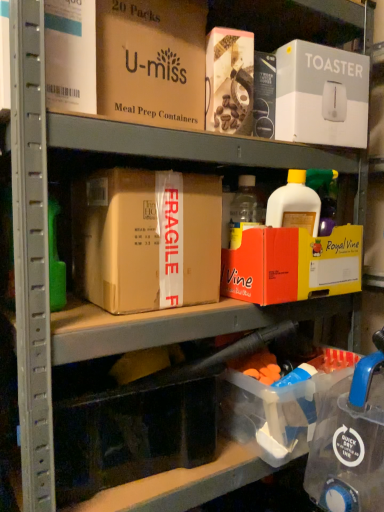
Question: Does transparent plastic storage box at lower center, which ranks as the second storage box in right-to-left order, appear on the right side of white cardboard toaster at upper right, the second box in the top-to-bottom sequence?

Choices:
 (A) no
 (B) yes

Answer: (A)

Question: Is there a large distance between transparent plastic storage box at lower center, which ranks as the second storage box in right-to-left order, and white cardboard toaster at upper right, the 3th box positioned from the bottom?

Choices:
 (A) yes
 (B) no

Answer: (B)

Question: From a real-world perspective, is transparent plastic storage box at lower center, which ranks as the second storage box in right-to-left order, under white cardboard toaster at upper right, the 3th box positioned from the bottom?

Choices:
 (A) no
 (B) yes

Answer: (B)

Question: Does transparent plastic storage box at lower center, which ranks as the 1th storage box in left-to-right order, come behind white cardboard toaster at upper right, the second box in the top-to-bottom sequence?

Choices:
 (A) no
 (B) yes

Answer: (A)

Question: Considering the relative sizes of transparent plastic storage box at lower center, which ranks as the 1th storage box in left-to-right order, and white cardboard toaster at upper right, the 3th box positioned from the bottom, in the image provided, is transparent plastic storage box at lower center, which ranks as the 1th storage box in left-to-right order, smaller than white cardboard toaster at upper right, the 3th box positioned from the bottom,?

Choices:
 (A) yes
 (B) no

Answer: (A)

Question: Visually, is orange cardboard box at upper center, the fourth box viewed from the top, positioned to the left or to the right of transparent plastic storage box at lower center, which ranks as the second storage box in right-to-left order?

Choices:
 (A) left
 (B) right

Answer: (B)

Question: Is orange cardboard box at upper center, placed as the first box when sorted from bottom to top, taller or shorter than transparent plastic storage box at lower center, which ranks as the second storage box in right-to-left order?

Choices:
 (A) short
 (B) tall

Answer: (A)

Question: Looking at the image, does orange cardboard box at upper center, the fourth box viewed from the top, seem bigger or smaller compared to transparent plastic storage box at lower center, which ranks as the 1th storage box in left-to-right order?

Choices:
 (A) big
 (B) small

Answer: (A)

Question: In the image, is orange cardboard box at upper center, the fourth box viewed from the top, positioned in front of or behind transparent plastic storage box at lower center, which ranks as the second storage box in right-to-left order?

Choices:
 (A) front
 (B) behind

Answer: (B)

Question: Considering the positions of brown cardboard box at upper center, which is counted as the fourth box, starting from the bottom, and transparent plastic storage box at lower center, which ranks as the second storage box in right-to-left order, in the image, is brown cardboard box at upper center, which is counted as the fourth box, starting from the bottom, bigger or smaller than transparent plastic storage box at lower center, which ranks as the second storage box in right-to-left order,?

Choices:
 (A) big
 (B) small

Answer: (A)

Question: From the image's perspective, relative to transparent plastic storage box at lower center, which ranks as the second storage box in right-to-left order, is brown cardboard box at upper center, which is the first box from top to bottom, above or below?

Choices:
 (A) above
 (B) below

Answer: (A)

Question: Considering the positions of brown cardboard box at upper center, which is counted as the fourth box, starting from the bottom, and transparent plastic storage box at lower center, which ranks as the 1th storage box in left-to-right order, in the image, is brown cardboard box at upper center, which is counted as the fourth box, starting from the bottom, taller or shorter than transparent plastic storage box at lower center, which ranks as the 1th storage box in left-to-right order,?

Choices:
 (A) short
 (B) tall

Answer: (B)

Question: Is brown cardboard box at upper center, which is the first box from top to bottom, wider or thinner than transparent plastic storage box at lower center, which ranks as the 1th storage box in left-to-right order?

Choices:
 (A) wide
 (B) thin

Answer: (A)

Question: Relative to clear plastic storage box at lower right, which is counted as the 1th storage box, starting from the right, is transparent plastic storage box at lower center, which ranks as the second storage box in right-to-left order, in front or behind?

Choices:
 (A) front
 (B) behind

Answer: (A)

Question: Would you say transparent plastic storage box at lower center, which ranks as the second storage box in right-to-left order, is inside or outside clear plastic storage box at lower right, the second storage box positioned from the left?

Choices:
 (A) inside
 (B) outside

Answer: (B)